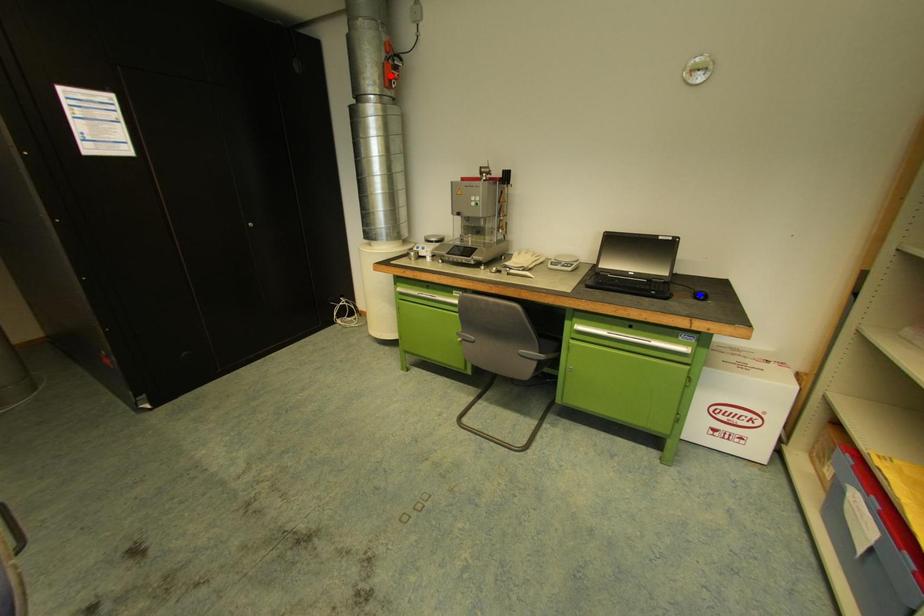
Question: In the image, two points are highlighted. Which point is nearer to the camera? Reply with the corresponding letter.

Choices:
 (A) blue point
 (B) red point

Answer: (A)